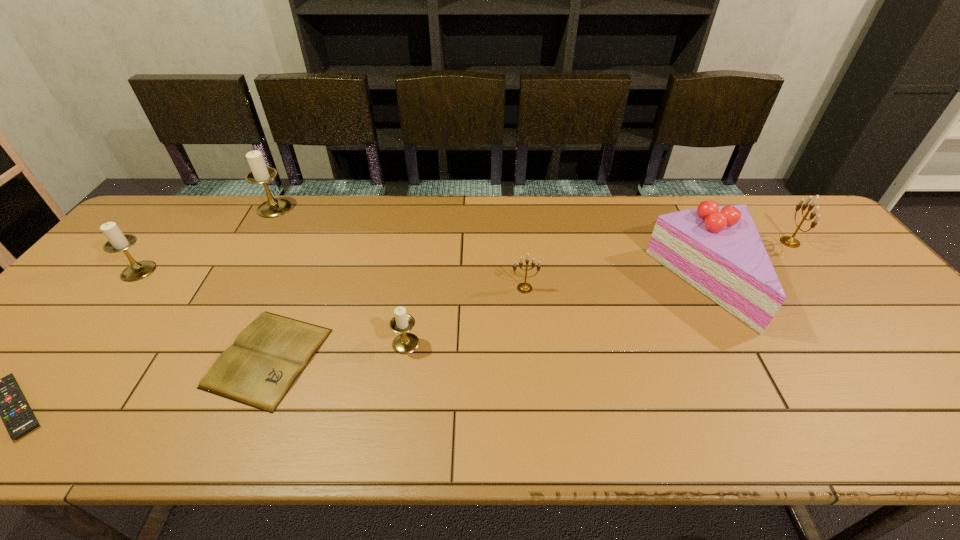
Where is `free spot located 0.170m on the back of the book`? The image size is (960, 540). free spot located 0.170m on the back of the book is located at coordinates (306, 267).

I want to click on cake at the far edge, so click(717, 249).

At what (x,y) coordinates should I click in order to perform the action: click on object located at the near edge. Please return your answer as a coordinate pair (x, y). Image resolution: width=960 pixels, height=540 pixels. Looking at the image, I should click on (258, 370).

Where is `object situated at the left edge`? The image size is (960, 540). object situated at the left edge is located at coordinates (117, 241).

The width and height of the screenshot is (960, 540). In order to click on object present at the right edge in this screenshot , I will do `click(789, 241)`.

Find the location of `object present at the far right corner`. object present at the far right corner is located at coordinates (789, 241).

Find the location of a particular element. blank area at the far edge is located at coordinates (654, 210).

In the image, there is a desktop. Where is `free region at the near edge`? free region at the near edge is located at coordinates (684, 415).

This screenshot has height=540, width=960. Find the location of `free space at the left edge of the desktop`. free space at the left edge of the desktop is located at coordinates (100, 308).

You are a GUI agent. You are given a task and a screenshot of the screen. Output one action in this format:
    pyautogui.click(x=<x>, y=<y>)
    Task: Click on the free space at the far left corner of the desktop
    This screenshot has height=540, width=960.
    Given the screenshot: What is the action you would take?
    pyautogui.click(x=172, y=210)